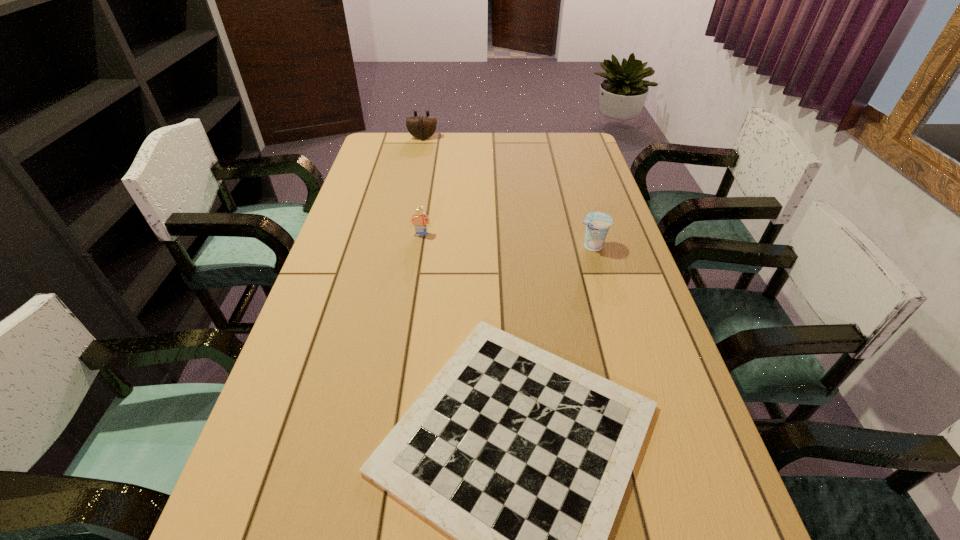
Locate an element on the screen. Image resolution: width=960 pixels, height=540 pixels. the farthest object is located at coordinates (421, 127).

This screenshot has width=960, height=540. I want to click on Lego, so click(420, 220).

Where is `yogurt`? The image size is (960, 540). yogurt is located at coordinates (597, 224).

Where is `vacant space located with the flap open on the pouch`? The image size is (960, 540). vacant space located with the flap open on the pouch is located at coordinates click(411, 195).

Where is `vacant space situated 0.310m on the front-facing side of the Lego`? This screenshot has width=960, height=540. vacant space situated 0.310m on the front-facing side of the Lego is located at coordinates (409, 312).

Locate an element on the screen. The height and width of the screenshot is (540, 960). vacant space situated on the front of the second nearest object is located at coordinates (615, 325).

Where is `object that is at the far edge`? This screenshot has width=960, height=540. object that is at the far edge is located at coordinates (421, 127).

Find the location of a particular element. This screenshot has height=540, width=960. object at the left edge is located at coordinates (421, 127).

You are a GUI agent. You are given a task and a screenshot of the screen. Output one action in this format:
    pyautogui.click(x=<x>, y=<y>)
    Task: Click on the object that is at the right edge
    
    Given the screenshot: What is the action you would take?
    click(597, 224)

Find the location of a particular element. Image resolution: width=960 pixels, height=540 pixels. object present at the far left corner is located at coordinates (421, 127).